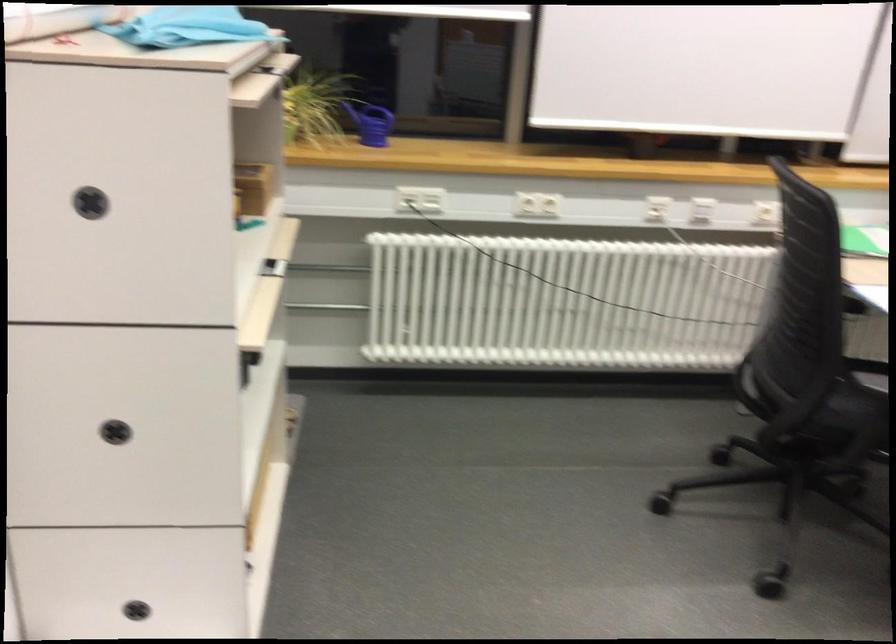
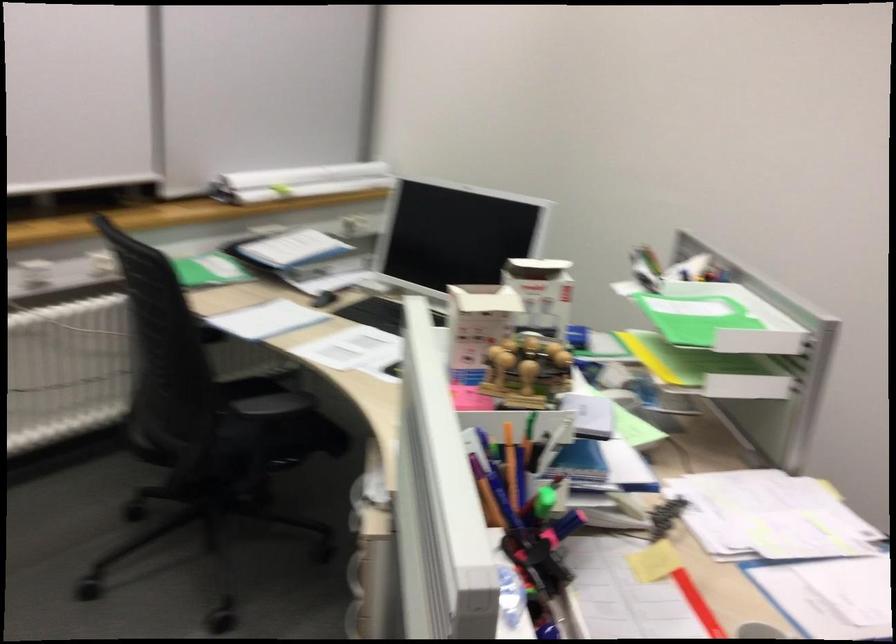
Question: The images are taken continuously from a first-person perspective. In which direction is your viewpoint rotating?

Choices:
 (A) Left
 (B) Right
 (C) Up
 (D) Down

Answer: (B)